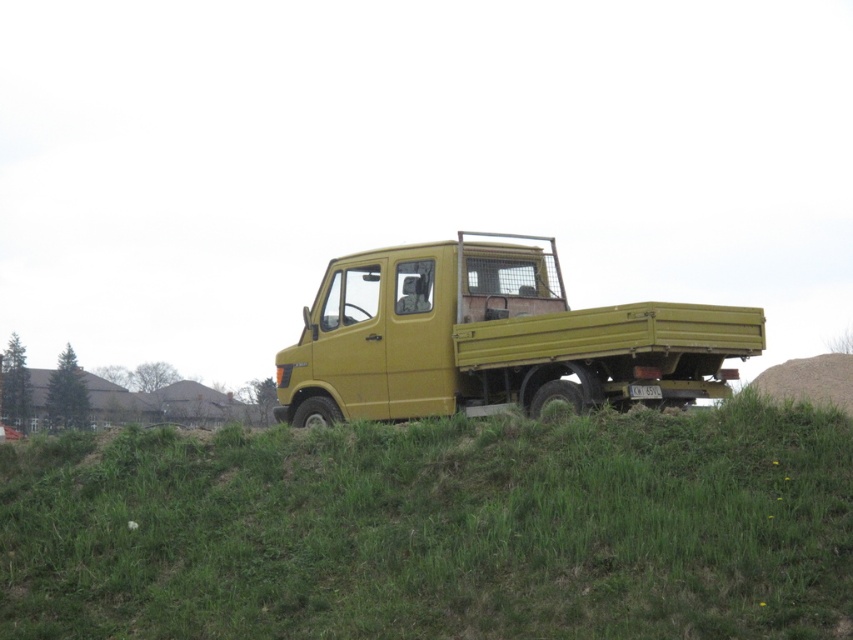
You are a delivery driver who needs to park your matte yellow truck at center on a green grassy hillside at center. Considering the size difference between the two, will the truck fit entirely on the hillside?

The green grassy hillside at center has a smaller size compared to matte yellow truck at center, so the truck will not fit entirely on the hillside.

You are standing in front of the yellow utility truck parked on the grassy slope. There are two points marked on the truck. Which point, point (805, 593) or point (477, 349), is closer to you?

Point (805, 593) is closer to you than point (477, 349).